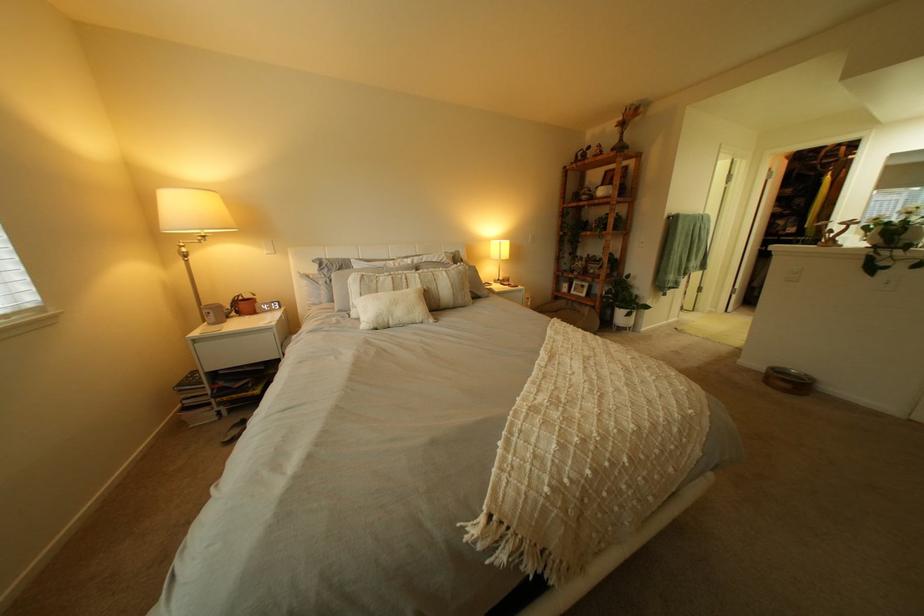
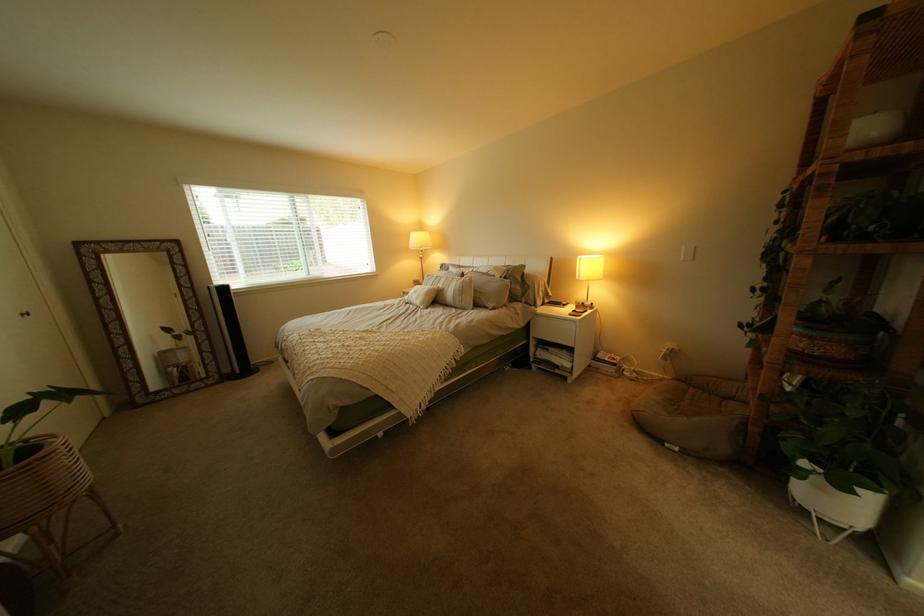
The point at (504, 297) is marked in the first image. Where is the corresponding point in the second image?

(509, 310)